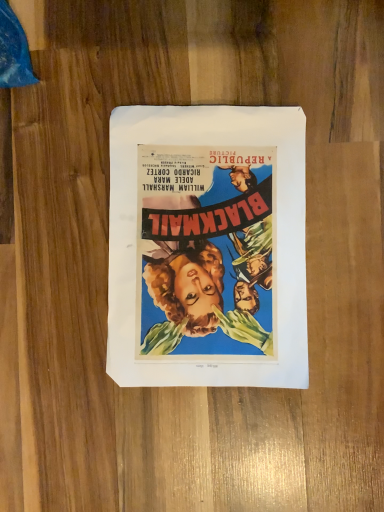
I want to click on matte paper poster at center, so click(207, 247).

Describe the element at coordinates (207, 247) in the screenshot. I see `matte paper poster at center` at that location.

The height and width of the screenshot is (512, 384). Find the location of `matte paper poster at center`. matte paper poster at center is located at coordinates (207, 247).